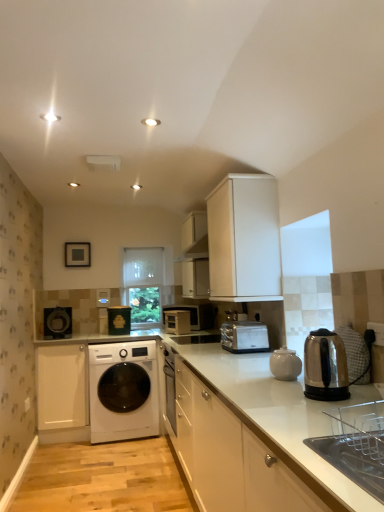
Question: Does white matte cabinet at upper center, which is the third cabinetry from left to right, have a lesser width compared to transparent plastic window screen at center, placed as the first window screen when sorted from top to bottom?

Choices:
 (A) yes
 (B) no

Answer: (B)

Question: From a real-world perspective, is white matte cabinet at upper center, which is the third cabinetry from left to right, on transparent plastic window screen at center, the 2th window screen in the bottom-to-top sequence?

Choices:
 (A) no
 (B) yes

Answer: (B)

Question: Is white matte cabinet at upper center, which is the third cabinetry from left to right, bigger than transparent plastic window screen at center, the 2th window screen in the bottom-to-top sequence?

Choices:
 (A) no
 (B) yes

Answer: (B)

Question: Could you tell me if white matte cabinet at upper center, which is the third cabinetry from left to right, is turned towards transparent plastic window screen at center, the 2th window screen in the bottom-to-top sequence?

Choices:
 (A) yes
 (B) no

Answer: (B)

Question: Is white matte cabinet at upper center, which is the third cabinetry from left to right, facing away from transparent plastic window screen at center, placed as the first window screen when sorted from top to bottom?

Choices:
 (A) yes
 (B) no

Answer: (B)

Question: Is metallic silver toaster at center, which is counted as the 3th appliance, starting from the left, bigger or smaller than white matte cabinet at lower left, the 4th cabinetry from the right?

Choices:
 (A) big
 (B) small

Answer: (B)

Question: From a real-world perspective, is metallic silver toaster at center, the 1th appliance viewed from the right, physically located above or below white matte cabinet at lower left, the 1th cabinetry viewed from the left?

Choices:
 (A) above
 (B) below

Answer: (A)

Question: Is metallic silver toaster at center, which is counted as the 3th appliance, starting from the left, wider or thinner than white matte cabinet at lower left, the 4th cabinetry from the right?

Choices:
 (A) wide
 (B) thin

Answer: (B)

Question: From the image's perspective, is metallic silver toaster at center, which is counted as the 3th appliance, starting from the left, located above or below white matte cabinet at lower left, the 1th cabinetry viewed from the left?

Choices:
 (A) below
 (B) above

Answer: (B)

Question: Looking at their shapes, would you say matte black washing machine at left, positioned as the 1th appliance in left-to-right order, is wider or thinner than transparent glass window at center, placed as the 1th window screen when sorted from bottom to top?

Choices:
 (A) wide
 (B) thin

Answer: (A)

Question: Is matte black washing machine at left, positioned as the 1th appliance in left-to-right order, spatially inside transparent glass window at center, placed as the 1th window screen when sorted from bottom to top, or outside of it?

Choices:
 (A) inside
 (B) outside

Answer: (B)

Question: Considering the positions of matte black washing machine at left, positioned as the 1th appliance in left-to-right order, and transparent glass window at center, placed as the 1th window screen when sorted from bottom to top, in the image, is matte black washing machine at left, positioned as the 1th appliance in left-to-right order, taller or shorter than transparent glass window at center, placed as the 1th window screen when sorted from bottom to top,?

Choices:
 (A) tall
 (B) short

Answer: (B)

Question: Would you say matte black washing machine at left, which is the third appliance in right-to-left order, is to the left or to the right of transparent glass window at center, placed as the 1th window screen when sorted from bottom to top, in the picture?

Choices:
 (A) left
 (B) right

Answer: (A)

Question: From the image's perspective, is white glossy cabinet at center, the fourth cabinetry when ordered from left to right, located above or below stainless steel kettle at right, which ranks as the first home appliance in front-to-back order?

Choices:
 (A) above
 (B) below

Answer: (B)

Question: From a real-world perspective, is white glossy cabinet at center, the fourth cabinetry when ordered from left to right, above or below stainless steel kettle at right, which appears as the second home appliance when viewed from the back?

Choices:
 (A) below
 (B) above

Answer: (A)